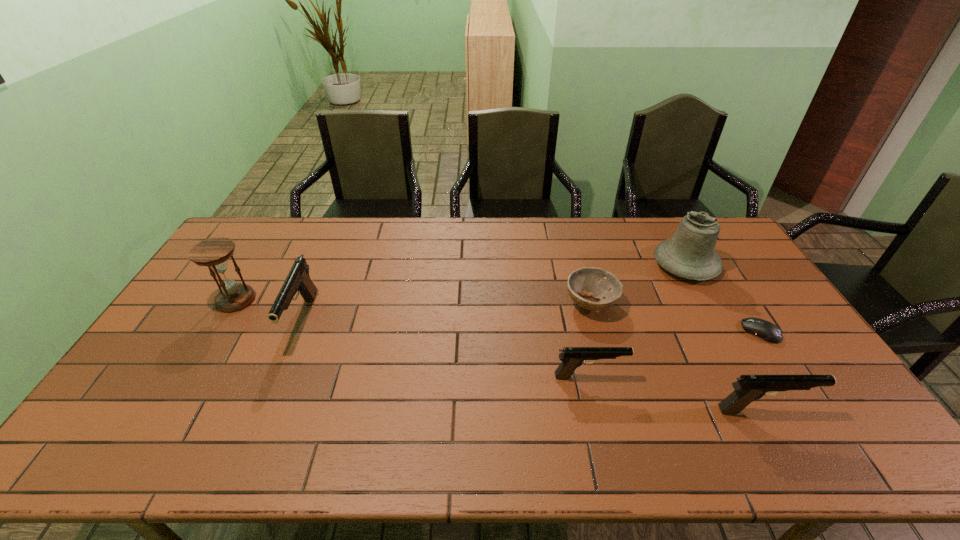
Where is `free space between the second shortest object and the computer equipment`? This screenshot has height=540, width=960. free space between the second shortest object and the computer equipment is located at coordinates (676, 318).

The image size is (960, 540). In order to click on free area in between the nearest pistol and the shortest object in this screenshot , I will do `click(761, 370)`.

What are the coordinates of `free space between the nearest object and the second pistol from left to right` in the screenshot? It's located at tap(676, 393).

You are a GUI agent. You are given a task and a screenshot of the screen. Output one action in this format:
    pyautogui.click(x=<x>, y=<y>)
    Task: Click on the empty space between the rightmost pistol and the leftmost object
    
    Given the screenshot: What is the action you would take?
    pyautogui.click(x=499, y=355)

Where is `vacant point located between the second farthest pistol and the leftmost object`? The width and height of the screenshot is (960, 540). vacant point located between the second farthest pistol and the leftmost object is located at coordinates (413, 338).

Find the location of a particular element. This screenshot has height=540, width=960. vacant space in between the shortest object and the bell is located at coordinates (723, 298).

Find the location of a particular element. vacant area between the hourglass and the sixth tallest object is located at coordinates (414, 301).

In order to click on vacant area that lies between the second pistol from left to right and the leftmost pistol in this screenshot , I will do `click(445, 348)`.

Locate an element on the screen. The image size is (960, 540). vacant space in between the bell and the bowl is located at coordinates (638, 284).

You are a GUI agent. You are given a task and a screenshot of the screen. Output one action in this format:
    pyautogui.click(x=<x>, y=<y>)
    Task: Click on the vacant point located between the bowl and the leftmost object
    This screenshot has width=960, height=540.
    Given the screenshot: What is the action you would take?
    pyautogui.click(x=414, y=301)